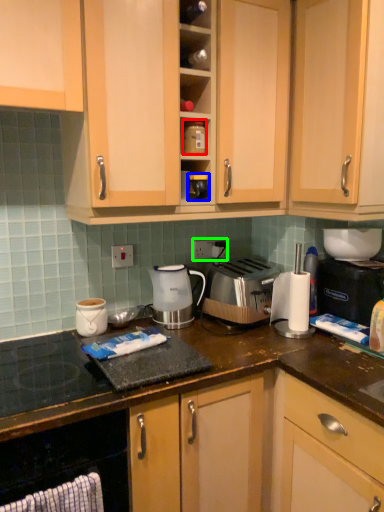
Question: Based on their relative distances, which object is farther from appliance (highlighted by a red box)? Choose from appliance (highlighted by a blue box) and electric outlet (highlighted by a green box).

Choices:
 (A) appliance
 (B) electric outlet

Answer: (B)